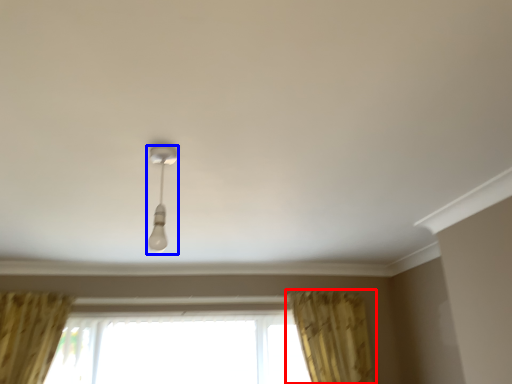
Question: Which object is further to the camera taking this photo, curtain (highlighted by a red box) or lamp (highlighted by a blue box)?

Choices:
 (A) curtain
 (B) lamp

Answer: (A)